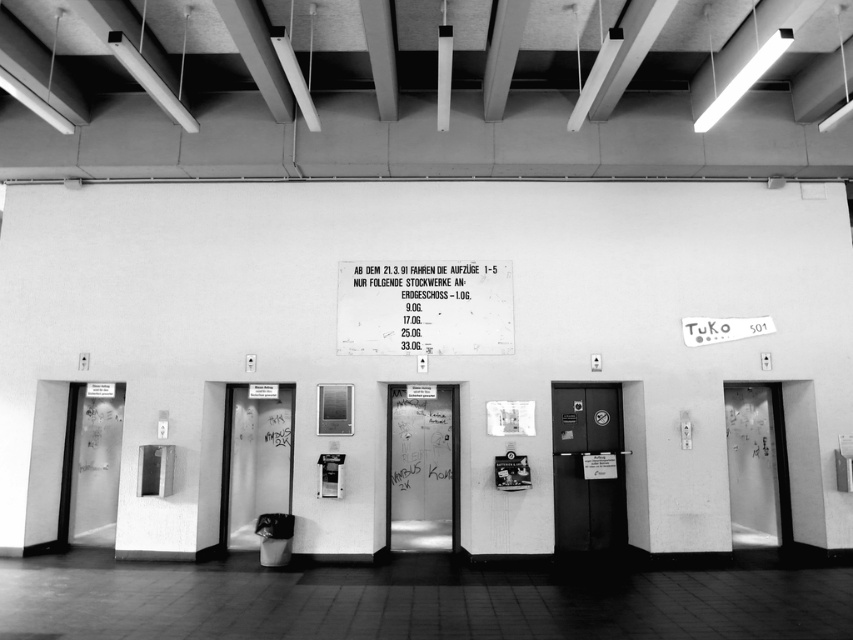
Is metallic sign at center behind metallic elevator door at center?

No, metallic sign at center is in front of metallic elevator door at center.

Is metallic sign at center to the left of metallic elevator door at center from the viewer's perspective?

Indeed, metallic sign at center is positioned on the left side of metallic elevator door at center.

In order to click on metallic sign at center in this screenshot , I will do `click(424, 308)`.

From the picture: Is smooth concrete wall at center closer to camera compared to transparent frosted glass elevator at center?

Yes, it is.

Is smooth concrete wall at center behind transparent frosted glass elevator at center?

No, smooth concrete wall at center is in front of transparent frosted glass elevator at center.

Who is more forward, (738, 362) or (434, 470)?

Point (738, 362)

Where is `smooth concrete wall at center`? The width and height of the screenshot is (853, 640). smooth concrete wall at center is located at coordinates (430, 355).

Which is in front, point (363, 307) or point (447, 470)?

Positioned in front is point (363, 307).

Which of these two, metallic sign at center or transparent frosted glass elevator at center, stands taller?

transparent frosted glass elevator at center is taller.

Is point (486, 272) positioned before point (416, 540)?

Yes.

Locate an element on the screen. The height and width of the screenshot is (640, 853). metallic sign at center is located at coordinates (424, 308).